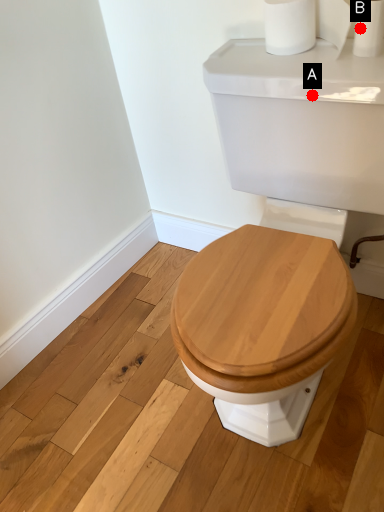
Question: Two points are circled on the image, labeled by A and B beside each circle. Which point is closer to the camera?

Choices:
 (A) A is closer
 (B) B is closer

Answer: (A)